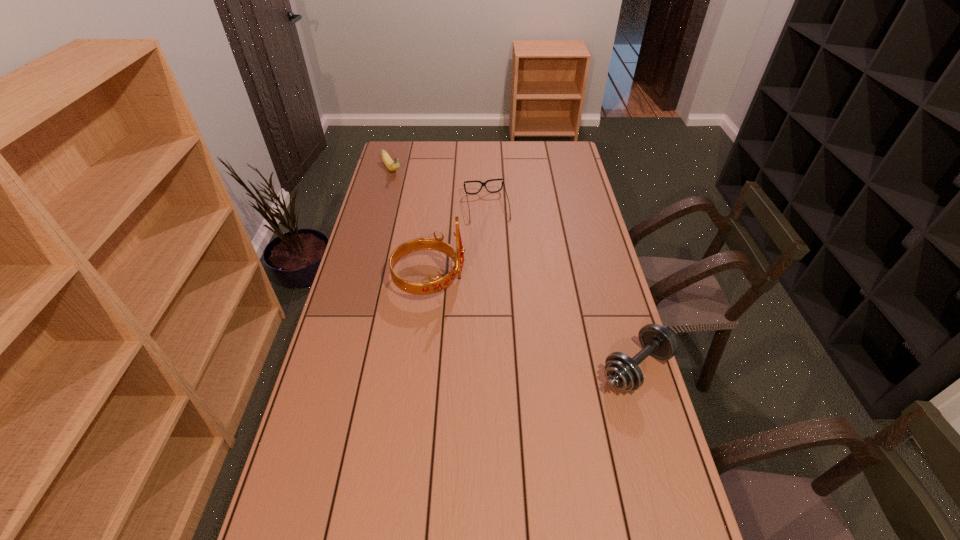
In order to click on object located at the far left corner in this screenshot , I will do `click(392, 165)`.

Where is `free spot at the far edge of the desktop`? This screenshot has height=540, width=960. free spot at the far edge of the desktop is located at coordinates (540, 150).

Locate an element on the screen. The height and width of the screenshot is (540, 960). vacant space at the left edge of the desktop is located at coordinates 382,192.

You are a GUI agent. You are given a task and a screenshot of the screen. Output one action in this format:
    pyautogui.click(x=<x>, y=<y>)
    Task: Click on the blank space at the right edge of the desktop
    This screenshot has width=960, height=540.
    Given the screenshot: What is the action you would take?
    pyautogui.click(x=566, y=258)

Identify the location of unoccupied position between the banana and the tiara. The image size is (960, 540). (411, 224).

Image resolution: width=960 pixels, height=540 pixels. I want to click on empty space between the tallest object and the dumbbell, so click(x=533, y=323).

Find the location of a particular element. vacant region between the second nearest object and the farthest object is located at coordinates (411, 224).

Image resolution: width=960 pixels, height=540 pixels. I want to click on free space between the rightmost object and the tallest object, so 533,323.

At what (x,y) coordinates should I click in order to perform the action: click on free point between the tallest object and the banana. Please return your answer as a coordinate pair (x, y). Image resolution: width=960 pixels, height=540 pixels. Looking at the image, I should click on (411, 224).

I want to click on free spot between the banana and the nearest object, so click(514, 269).